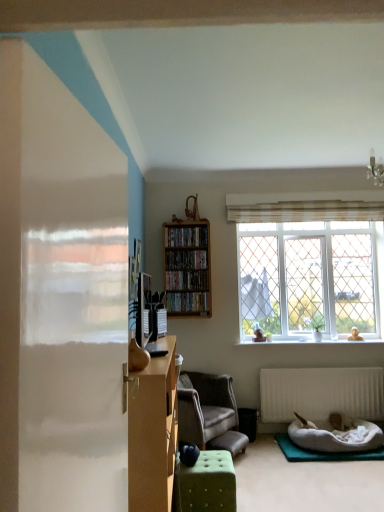
Question: Looking at the image, does white matte radiator at lower center seem bigger or smaller compared to wooden bookshelf at center, acting as the 2th shelf starting from the top?

Choices:
 (A) small
 (B) big

Answer: (B)

Question: Considering the positions of white matte radiator at lower center and wooden bookshelf at center, the 2th shelf when ordered from bottom to top, in the image, is white matte radiator at lower center wider or thinner than wooden bookshelf at center, the 2th shelf when ordered from bottom to top,?

Choices:
 (A) wide
 (B) thin

Answer: (B)

Question: Estimate the real-world distances between objects in this image. Which object is farther from the white plush pet bed at lower right?

Choices:
 (A) green tufted ottoman at center
 (B) wooden bookshelf at center, acting as the 2th shelf starting from the top
 (C) white glass window at upper right
 (D) wooden bookshelf at center, the 3th shelf positioned from the top
 (E) wooden bookshelf at center, positioned as the 1th cabinet in bottom-to-top order

Answer: (E)

Question: Which object is the farthest from the white plush pet bed at lower right?

Choices:
 (A) velvet grey armchair at center
 (B) wooden bookshelf at center, which ranks as the 1th shelf in top-to-bottom order
 (C) green tufted ottoman at center
 (D) white matte radiator at lower center
 (E) green fabric yoga mat at lower right

Answer: (B)